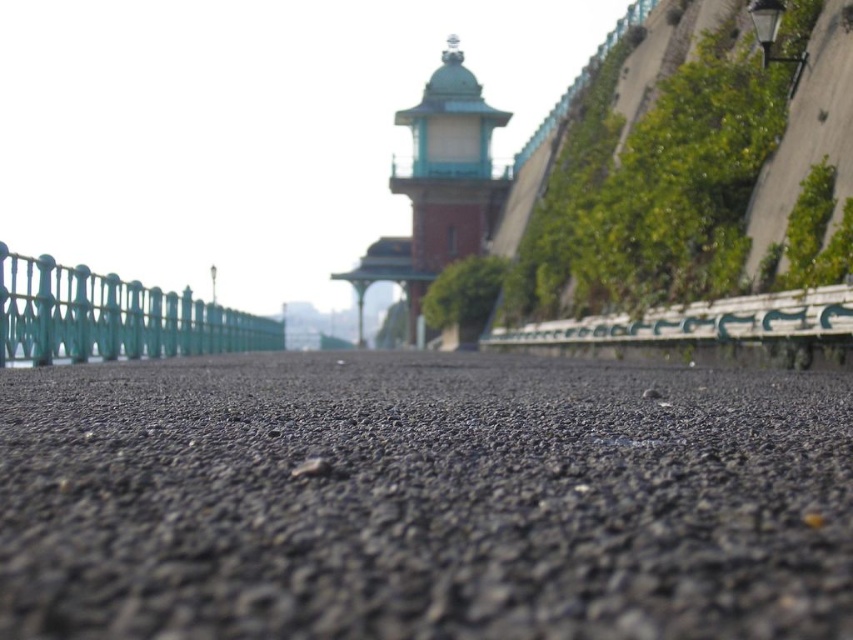
Can you confirm if black gravel at center is wider than teal glossy fence at left?

No, black gravel at center is not wider than teal glossy fence at left.

Is black gravel at center above teal glossy fence at left?

Indeed, black gravel at center is positioned over teal glossy fence at left.

Is point (363, 428) closer to viewer compared to point (39, 310)?

Yes, it is in front of point (39, 310).

At what (x,y) coordinates should I click in order to perform the action: click on black gravel at center. Please return your answer as a coordinate pair (x, y). Image resolution: width=853 pixels, height=640 pixels. Looking at the image, I should click on (422, 499).